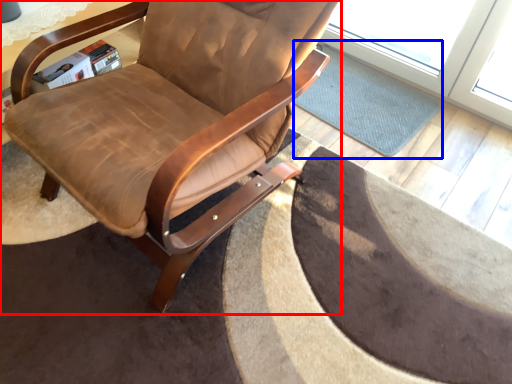
Question: Which object appears farthest to the camera in this image, chair (highlighted by a red box) or mat (highlighted by a blue box)?

Choices:
 (A) chair
 (B) mat

Answer: (B)